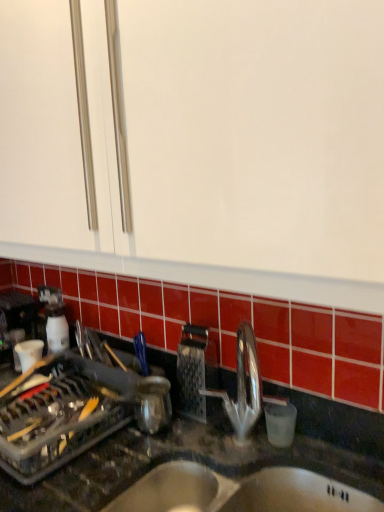
Question: Considering the positions of metallic grater at center and black granite countertop at center in the image, is metallic grater at center taller or shorter than black granite countertop at center?

Choices:
 (A) tall
 (B) short

Answer: (B)

Question: Is metallic grater at center in front of or behind black granite countertop at center in the image?

Choices:
 (A) front
 (B) behind

Answer: (B)

Question: Which of these objects is positioned farthest from the black granite countertop at center?

Choices:
 (A) stainless steel sink at lower center
 (B) metallic grater at center

Answer: (B)

Question: Estimate the real-world distances between objects in this image. Which object is farther from the black granite countertop at center?

Choices:
 (A) stainless steel sink at lower center
 (B) metallic grater at center

Answer: (B)